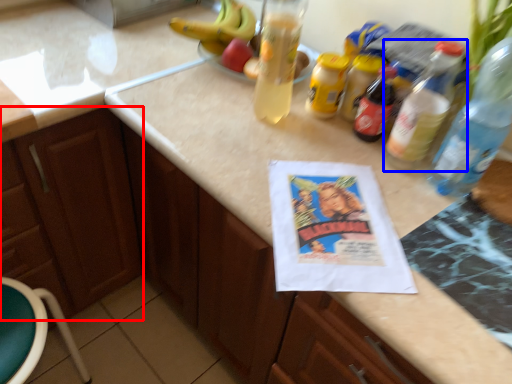
Question: Which point is closer to the camera, cabinetry (highlighted by a red box) or bottle (highlighted by a blue box)?

Choices:
 (A) cabinetry
 (B) bottle

Answer: (B)